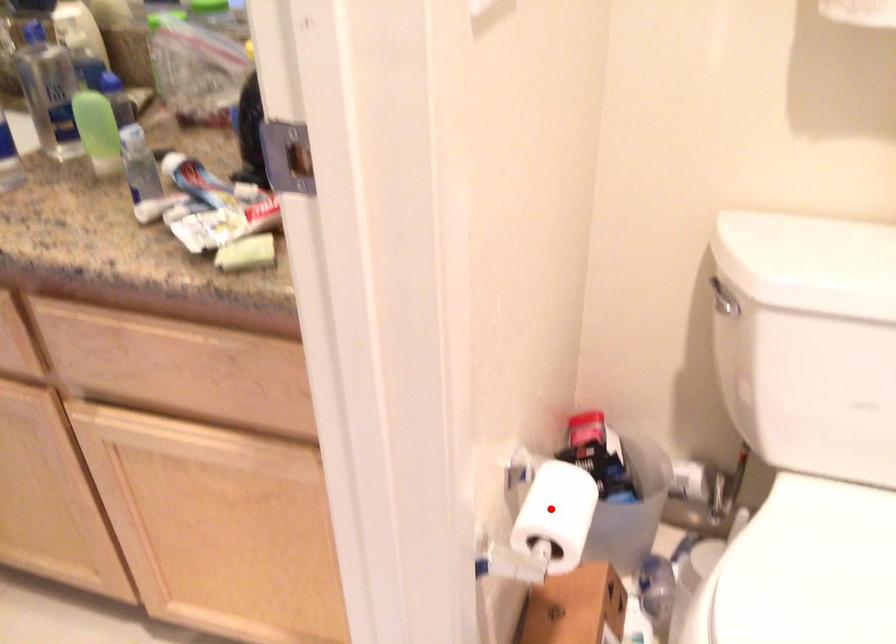
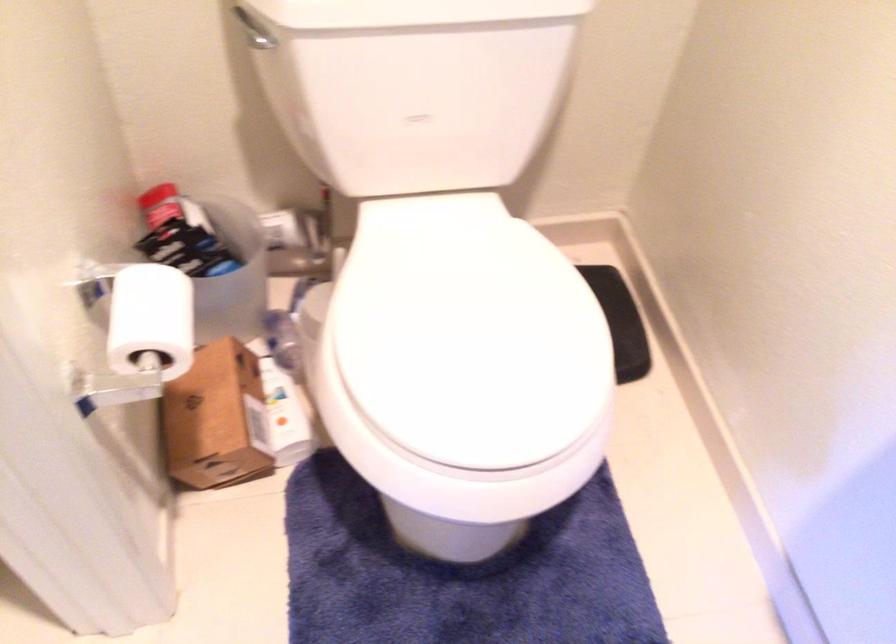
Find the pixel in the second image that matches the highlighted location in the first image.

(151, 319)